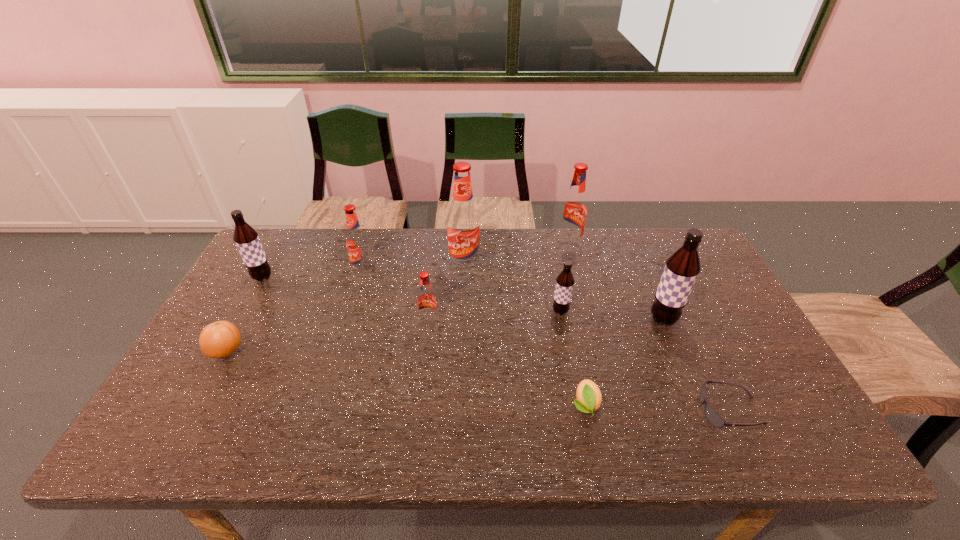
Where is `vacant space located 0.090m on the lenses of the sunglasses`? vacant space located 0.090m on the lenses of the sunglasses is located at coordinates (662, 410).

Locate an element on the screen. lemon located in the near edge section of the desktop is located at coordinates (589, 398).

Where is `sunglasses at the near edge`? Image resolution: width=960 pixels, height=540 pixels. sunglasses at the near edge is located at coordinates [712, 416].

This screenshot has width=960, height=540. I want to click on root beer located at the left edge, so click(x=246, y=238).

Image resolution: width=960 pixels, height=540 pixels. What are the coordinates of `orange located at the left edge` in the screenshot? It's located at (220, 339).

Find the location of a particular element. The height and width of the screenshot is (540, 960). object located in the right edge section of the desktop is located at coordinates (712, 416).

Identify the location of object at the far left corner. Image resolution: width=960 pixels, height=540 pixels. (246, 238).

Where is `object at the near right corner`? This screenshot has height=540, width=960. object at the near right corner is located at coordinates (712, 416).

Identify the location of vacant space at the far edge of the desktop. This screenshot has width=960, height=540. (597, 260).

Where is `vacant space at the near edge of the desktop`? vacant space at the near edge of the desktop is located at coordinates (471, 418).